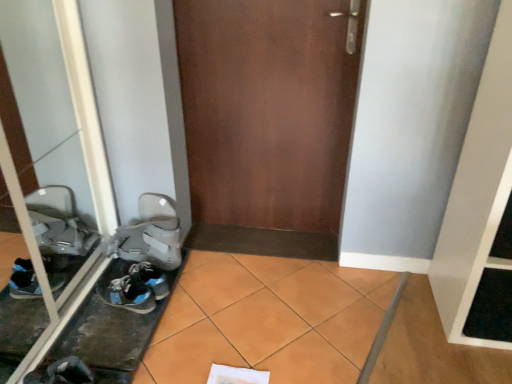
Question: Is dark gray fabric sneaker at lower left, the 1th footwear from the bottom, oriented towards transparent glass door at left?

Choices:
 (A) yes
 (B) no

Answer: (B)

Question: Considering the relative positions of dark gray fabric sneaker at lower left, the 1th footwear from the bottom, and transparent glass door at left in the image provided, is dark gray fabric sneaker at lower left, the 1th footwear from the bottom, to the right of transparent glass door at left from the viewer's perspective?

Choices:
 (A) yes
 (B) no

Answer: (A)

Question: Can you confirm if dark gray fabric sneaker at lower left, which appears as the third footwear when viewed from the back, is thinner than transparent glass door at left?

Choices:
 (A) yes
 (B) no

Answer: (B)

Question: Does dark gray fabric sneaker at lower left, which is the 1th footwear in front-to-back order, have a lesser height compared to transparent glass door at left?

Choices:
 (A) no
 (B) yes

Answer: (B)

Question: Can you confirm if dark gray fabric sneaker at lower left, which appears as the third footwear when viewed from the back, is taller than transparent glass door at left?

Choices:
 (A) yes
 (B) no

Answer: (B)

Question: Considering their positions, is blue synthetic sneakers at lower left, the 2th footwear in the back-to-front sequence, located in front of or behind transparent glass door at left?

Choices:
 (A) front
 (B) behind

Answer: (B)

Question: Is point (105, 291) positioned closer to the camera than point (28, 213)?

Choices:
 (A) farther
 (B) closer

Answer: (B)

Question: Looking at their shapes, would you say blue synthetic sneakers at lower left, acting as the second footwear starting from the top, is wider or thinner than transparent glass door at left?

Choices:
 (A) thin
 (B) wide

Answer: (B)

Question: In terms of size, does blue synthetic sneakers at lower left, which is the 2th footwear in front-to-back order, appear bigger or smaller than transparent glass door at left?

Choices:
 (A) small
 (B) big

Answer: (A)

Question: Looking at their shapes, would you say dark gray fabric sneaker at lower left, the 1th footwear from the bottom, is wider or thinner than brown matte door at center?

Choices:
 (A) wide
 (B) thin

Answer: (A)

Question: Considering the positions of point (46, 379) and point (245, 110), is point (46, 379) closer or farther from the camera than point (245, 110)?

Choices:
 (A) farther
 (B) closer

Answer: (B)

Question: Is dark gray fabric sneaker at lower left, the 1th footwear from the bottom, bigger or smaller than brown matte door at center?

Choices:
 (A) small
 (B) big

Answer: (A)

Question: From the image's perspective, relative to brown matte door at center, is dark gray fabric sneaker at lower left, marked as the 3th footwear in a top-to-bottom arrangement, above or below?

Choices:
 (A) above
 (B) below

Answer: (B)

Question: From their relative heights in the image, would you say brown matte door at center is taller or shorter than transparent glass door at left?

Choices:
 (A) tall
 (B) short

Answer: (B)

Question: Visually, is brown matte door at center positioned to the left or to the right of transparent glass door at left?

Choices:
 (A) right
 (B) left

Answer: (A)